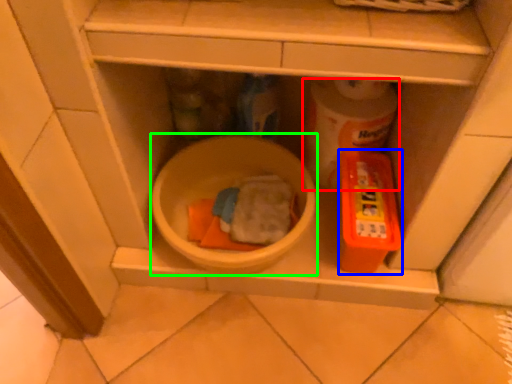
Question: Considering the real-world distances, which object is farthest from toilet paper (highlighted by a red box)? toy (highlighted by a blue box) or mixing bowl (highlighted by a green box)?

Choices:
 (A) toy
 (B) mixing bowl

Answer: (B)